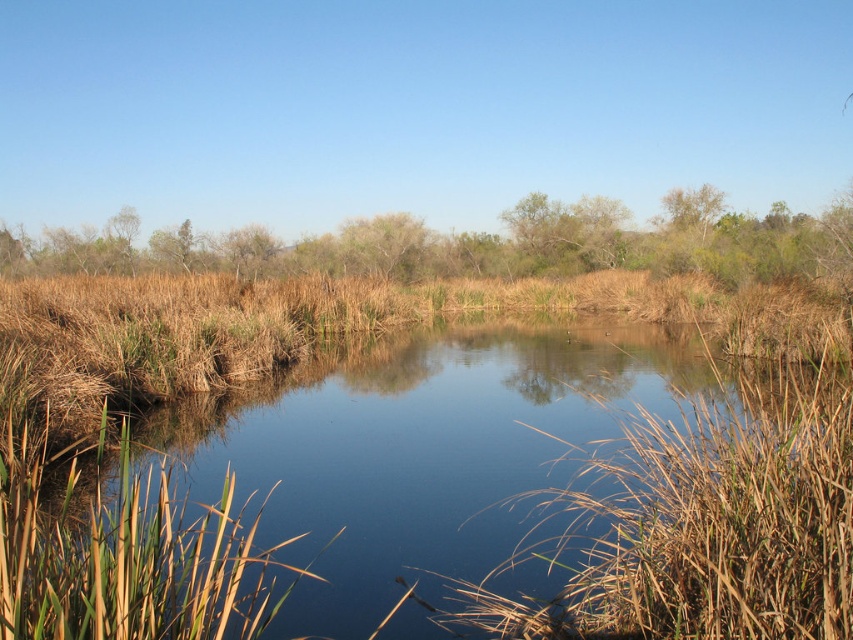
You are standing at the edge of the pond and want to determine which of the two green leafy trees is closer to you. The trees are the green leafy tree at center and the green leafy tree at upper right. Based on their positions, which one is nearer?

The green leafy tree at center is wider than the green leafy tree at upper right, so it is closer to you.

You are a hiker who wants to cross the brown grassy river at center and reach the green leafy tree at upper right. Given that you can walk 5 meters per minute, how many minutes will it take you to reach the tree from the river?

The distance between the brown grassy river at center and the green leafy tree at upper right is 42.04 meters. At a walking speed of 5 meters per minute, it would take approximately 8.41 minutes to reach the tree. Since you can walk 5 meters every minute, dividing 42.04 by 5 gives roughly 8.41 minutes.

You are standing at the edge of the scene and want to walk towards the green leafy tree at upper right. Which direction should you go relative to the brown grassy river at center?

You should walk to the right of the brown grassy river at center to reach the green leafy tree at upper right because the brown grassy river at center is to the left of the green leafy tree at upper right.